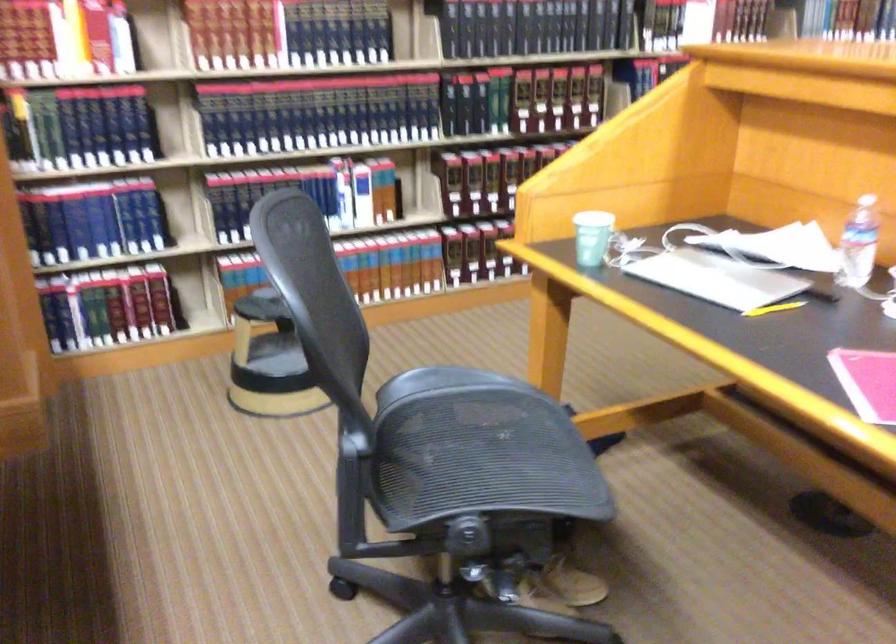
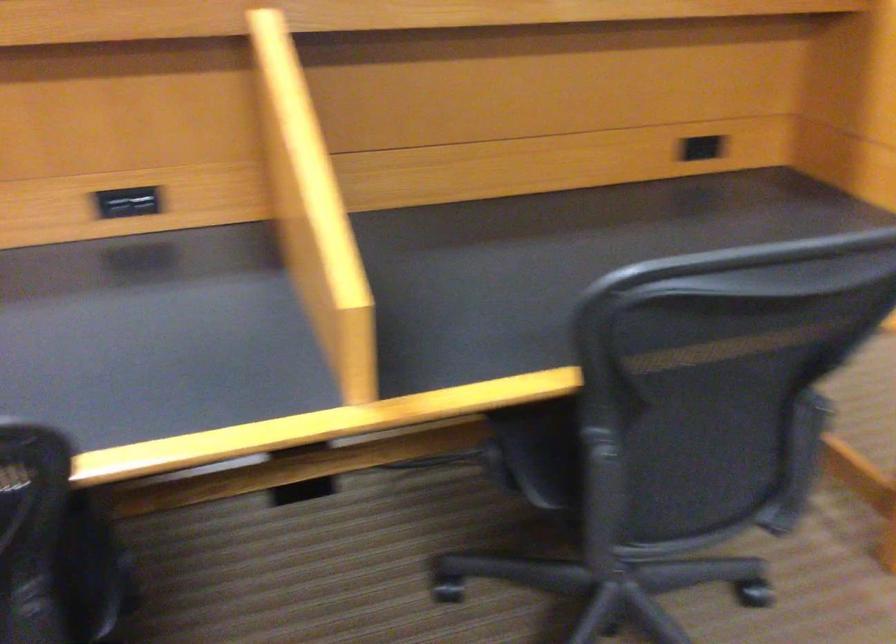
Question: I am providing you with two images of the same scene from different viewpoints. Please identify which objects are invisible in image2.

Choices:
 (A) USB port
 (B) chair sitting surface
 (C) black power outlet
 (D) green paper cup

Answer: (D)